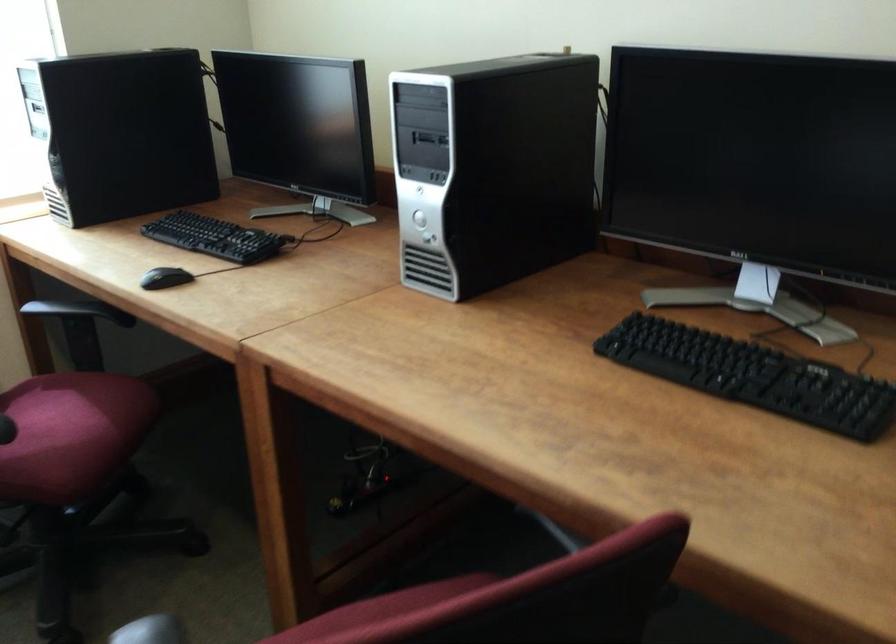
This screenshot has height=644, width=896. What do you see at coordinates (165, 278) in the screenshot?
I see `the black computer mouse` at bounding box center [165, 278].